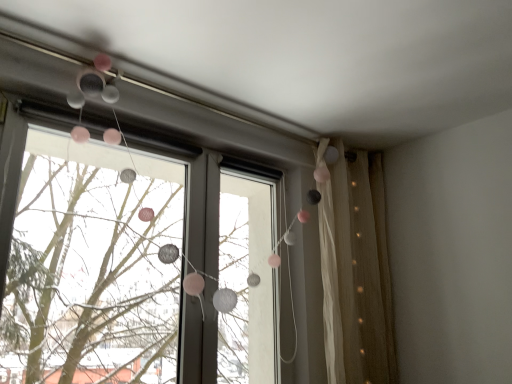
This screenshot has height=384, width=512. I want to click on beige sheer curtain at right, so click(355, 273).

What do you see at coordinates (355, 273) in the screenshot? This screenshot has height=384, width=512. I see `beige sheer curtain at right` at bounding box center [355, 273].

The image size is (512, 384). Find the location of `matte silver garland at upper center`. matte silver garland at upper center is located at coordinates (349, 276).

The height and width of the screenshot is (384, 512). What do you see at coordinates (349, 276) in the screenshot? I see `matte silver garland at upper center` at bounding box center [349, 276].

Where is `beige sheer curtain at right`? beige sheer curtain at right is located at coordinates (355, 273).

Does beige sheer curtain at right appear on the left side of matte silver garland at upper center?

In fact, beige sheer curtain at right is to the right of matte silver garland at upper center.

Which object is more forward, beige sheer curtain at right or matte silver garland at upper center?

matte silver garland at upper center.

Considering the positions of points (327, 291) and (385, 353), is point (327, 291) farther from camera compared to point (385, 353)?

That is False.

From the image's perspective, which object appears higher, beige sheer curtain at right or matte silver garland at upper center?

matte silver garland at upper center appears higher in the image.

From a real-world perspective, is beige sheer curtain at right below matte silver garland at upper center?

Yes, from a real-world perspective, beige sheer curtain at right is below matte silver garland at upper center.

Which of these two, beige sheer curtain at right or matte silver garland at upper center, is wider?

Wider between the two is beige sheer curtain at right.

Who is shorter, beige sheer curtain at right or matte silver garland at upper center?

Standing shorter between the two is matte silver garland at upper center.

Considering the relative sizes of beige sheer curtain at right and matte silver garland at upper center in the image provided, is beige sheer curtain at right smaller than matte silver garland at upper center?

Yes, beige sheer curtain at right is smaller than matte silver garland at upper center.

Can matte silver garland at upper center be found inside beige sheer curtain at right?

No.

Are beige sheer curtain at right and matte silver garland at upper center located far from each other?

No, beige sheer curtain at right is in close proximity to matte silver garland at upper center.

Does beige sheer curtain at right turn towards matte silver garland at upper center?

No, beige sheer curtain at right is not turned towards matte silver garland at upper center.

Measure the distance between beige sheer curtain at right and matte silver garland at upper center.

5.89 inches.

This screenshot has height=384, width=512. In order to click on window above the beige sheer curtain at right (from the image's perspective) in this screenshot , I will do `click(349, 276)`.

Considering the positions of objects matte silver garland at upper center and beige sheer curtain at right in the image provided, who is more to the left, matte silver garland at upper center or beige sheer curtain at right?

From the viewer's perspective, matte silver garland at upper center appears more on the left side.

Which is behind, matte silver garland at upper center or beige sheer curtain at right?

beige sheer curtain at right is further from the camera.

Does point (211, 138) come closer to viewer compared to point (362, 354)?

That is True.

From the image's perspective, is matte silver garland at upper center positioned above or below beige sheer curtain at right?

Based on their image positions, matte silver garland at upper center is located above beige sheer curtain at right.

From a real-world perspective, who is located lower, matte silver garland at upper center or beige sheer curtain at right?

From a 3D spatial view, beige sheer curtain at right is below.

Looking at this image, between matte silver garland at upper center and beige sheer curtain at right, which one has smaller width?

Thinner between the two is matte silver garland at upper center.

Between matte silver garland at upper center and beige sheer curtain at right, which one has less height?

Standing shorter between the two is matte silver garland at upper center.

Does matte silver garland at upper center have a larger size compared to beige sheer curtain at right?

Indeed, matte silver garland at upper center has a larger size compared to beige sheer curtain at right.

Would you say matte silver garland at upper center is outside beige sheer curtain at right?

Yes, matte silver garland at upper center is outside of beige sheer curtain at right.

Is matte silver garland at upper center with beige sheer curtain at right?

No, matte silver garland at upper center is not beside beige sheer curtain at right.

Could you tell me if matte silver garland at upper center is turned towards beige sheer curtain at right?

No, matte silver garland at upper center does not turn towards beige sheer curtain at right.

Looking at this image, how many degrees apart are the facing directions of matte silver garland at upper center and beige sheer curtain at right?

The angular difference between matte silver garland at upper center and beige sheer curtain at right is 3.4 degrees.

How much distance is there between matte silver garland at upper center and beige sheer curtain at right?

matte silver garland at upper center is 5.89 inches away from beige sheer curtain at right.

At what (x,y) coordinates should I click in order to perform the action: click on curtain on the right of matte silver garland at upper center. Please return your answer as a coordinate pair (x, y). The image size is (512, 384). Looking at the image, I should click on (355, 273).

Where is `curtain behind the matte silver garland at upper center`? curtain behind the matte silver garland at upper center is located at coordinates (355, 273).

At what (x,y) coordinates should I click in order to perform the action: click on curtain located below the matte silver garland at upper center (from the image's perspective). Please return your answer as a coordinate pair (x, y). The image size is (512, 384). Looking at the image, I should click on (355, 273).